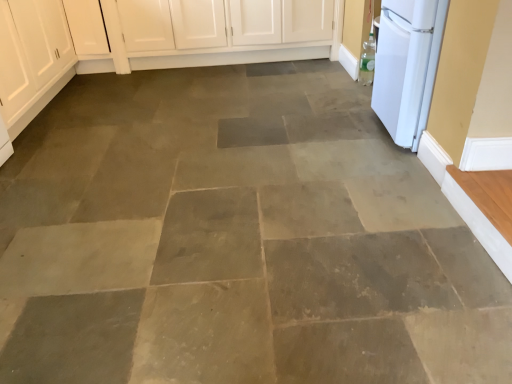
What do you see at coordinates (407, 66) in the screenshot? The image size is (512, 384). I see `white matte refrigerator at right` at bounding box center [407, 66].

Where is `white matte refrigerator at right`? The width and height of the screenshot is (512, 384). white matte refrigerator at right is located at coordinates (407, 66).

The width and height of the screenshot is (512, 384). What do you see at coordinates (32, 58) in the screenshot? I see `matte white cabinet at left` at bounding box center [32, 58].

Locate an element on the screen. The width and height of the screenshot is (512, 384). matte white cabinet at left is located at coordinates (32, 58).

You are a GUI agent. You are given a task and a screenshot of the screen. Output one action in this format:
    pyautogui.click(x=<x>, y=<y>)
    Task: Click on the white matte refrigerator at right
    Image resolution: width=512 pixels, height=384 pixels.
    Given the screenshot: What is the action you would take?
    pyautogui.click(x=407, y=66)

Would you say white matte refrigerator at right is to the left or to the right of matte white cabinet at left in the picture?

Based on their positions, white matte refrigerator at right is located to the right of matte white cabinet at left.

Relative to matte white cabinet at left, is white matte refrigerator at right in front or behind?

Visually, white matte refrigerator at right is located in front of matte white cabinet at left.

Which point is more forward, (404, 143) or (25, 112)?

The point (404, 143) is in front.

From the image's perspective, which object appears higher, white matte refrigerator at right or matte white cabinet at left?

matte white cabinet at left, from the image's perspective.

From a real-world perspective, is white matte refrigerator at right over matte white cabinet at left?

Yes.

Which object is wider, white matte refrigerator at right or matte white cabinet at left?

matte white cabinet at left is wider.

Which of these two, white matte refrigerator at right or matte white cabinet at left, stands taller?

matte white cabinet at left.

Based on their sizes in the image, would you say white matte refrigerator at right is bigger or smaller than matte white cabinet at left?

In the image, white matte refrigerator at right appears to be smaller than matte white cabinet at left.

Looking at this image, is white matte refrigerator at right not inside matte white cabinet at left?

white matte refrigerator at right lies outside matte white cabinet at left's area.

Are white matte refrigerator at right and matte white cabinet at left far apart?

Yes, white matte refrigerator at right and matte white cabinet at left are located far from each other.

Is white matte refrigerator at right oriented away from matte white cabinet at left?

No, white matte refrigerator at right is not facing away from matte white cabinet at left.

Where is `cabinetry behind the white matte refrigerator at right`? cabinetry behind the white matte refrigerator at right is located at coordinates (32, 58).

Is matte white cabinet at left at the right side of white matte refrigerator at right?

No.

Consider the image. Which object is closer to the camera, matte white cabinet at left or white matte refrigerator at right?

white matte refrigerator at right is more forward.

Is point (28, 54) farther from camera compared to point (399, 20)?

That is True.

Looking at this image, from the image's perspective, which is above, matte white cabinet at left or white matte refrigerator at right?

matte white cabinet at left.

From a real-world perspective, who is located lower, matte white cabinet at left or white matte refrigerator at right?

matte white cabinet at left.

Consider the image. Considering the sizes of objects matte white cabinet at left and white matte refrigerator at right in the image provided, who is thinner, matte white cabinet at left or white matte refrigerator at right?

With smaller width is white matte refrigerator at right.

Is matte white cabinet at left taller than white matte refrigerator at right?

Yes.

Who is bigger, matte white cabinet at left or white matte refrigerator at right?

With larger size is matte white cabinet at left.

Can white matte refrigerator at right be found inside matte white cabinet at left?

No, white matte refrigerator at right is located outside of matte white cabinet at left.

Are matte white cabinet at left and white matte refrigerator at right making contact?

They are not placed beside each other.

Is matte white cabinet at left oriented away from white matte refrigerator at right?

No.

How many degrees apart are the facing directions of matte white cabinet at left and white matte refrigerator at right?

179 degrees.

Locate an element on the screen. cabinetry above the white matte refrigerator at right (from the image's perspective) is located at coordinates (32, 58).

At what (x,y) coordinates should I click in order to perform the action: click on cabinetry above the white matte refrigerator at right (from the image's perspective). Please return your answer as a coordinate pair (x, y). The height and width of the screenshot is (384, 512). Looking at the image, I should click on (32, 58).

There is a matte white cabinet at left. Identify the location of home appliance above it (from a real-world perspective). This screenshot has width=512, height=384. (407, 66).